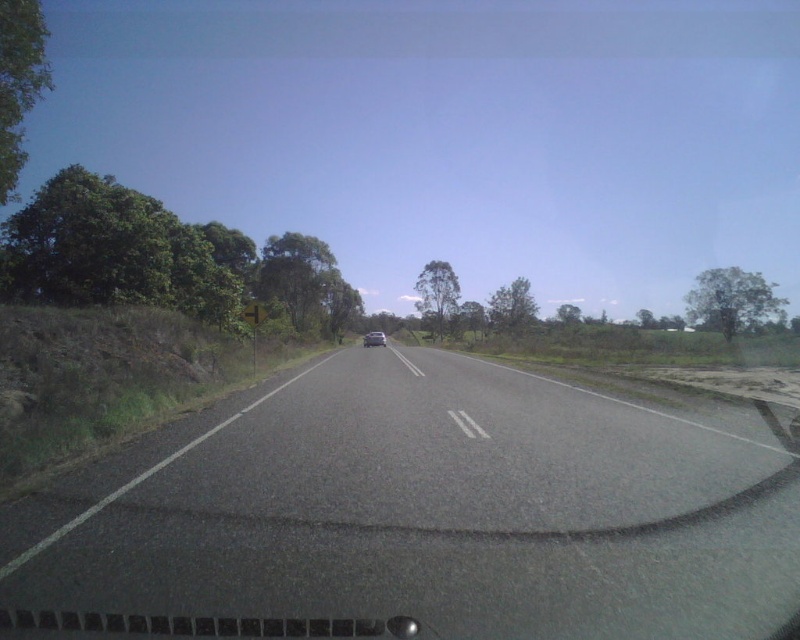
Does asphalt road at center appear under satin silver sedan at center?

Indeed, asphalt road at center is positioned under satin silver sedan at center.

Which is behind, point (656, 433) or point (381, 337)?

Point (381, 337)

This screenshot has height=640, width=800. I want to click on asphalt road at center, so click(418, 515).